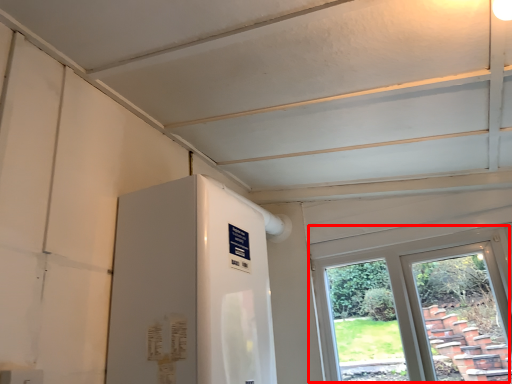
Question: In this image, where is window (annotated by the red box) located relative to water heater?

Choices:
 (A) right
 (B) left

Answer: (A)